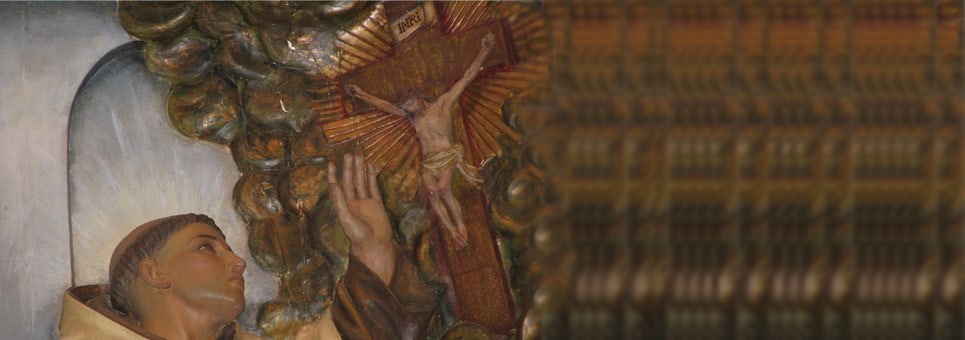
You are a GUI agent. You are given a task and a screenshot of the screen. Output one action in this format:
    pyautogui.click(x=<x>, y=<y>)
    Task: Click on the crucifix
    
    Given the screenshot: What is the action you would take?
    point(419,74)